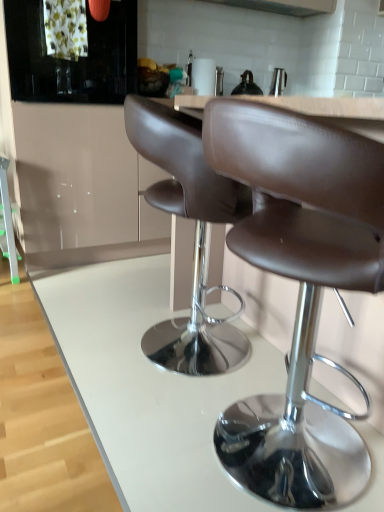
Question: Is satin silver exhaust hood at upper center located within brown leather stool at center?

Choices:
 (A) yes
 (B) no

Answer: (B)

Question: Is brown leather stool at center not near satin silver exhaust hood at upper center?

Choices:
 (A) no
 (B) yes

Answer: (B)

Question: Is brown leather stool at center wider than satin silver exhaust hood at upper center?

Choices:
 (A) yes
 (B) no

Answer: (A)

Question: Is brown leather stool at center at the right side of satin silver exhaust hood at upper center?

Choices:
 (A) no
 (B) yes

Answer: (A)

Question: Can you confirm if brown leather stool at center is bigger than satin silver exhaust hood at upper center?

Choices:
 (A) yes
 (B) no

Answer: (A)

Question: From the image's perspective, is black glass cabinet at upper left, marked as the second cabinetry in a bottom-to-top arrangement, located above or below brown leather stool at center?

Choices:
 (A) above
 (B) below

Answer: (A)

Question: In terms of size, does black glass cabinet at upper left, marked as the second cabinetry in a bottom-to-top arrangement, appear bigger or smaller than brown leather stool at center?

Choices:
 (A) big
 (B) small

Answer: (B)

Question: Is black glass cabinet at upper left, the 1th cabinetry from the top, in front of or behind brown leather stool at center in the image?

Choices:
 (A) behind
 (B) front

Answer: (A)

Question: In terms of height, does black glass cabinet at upper left, marked as the second cabinetry in a bottom-to-top arrangement, look taller or shorter compared to brown leather stool at center?

Choices:
 (A) tall
 (B) short

Answer: (B)

Question: In terms of height, does glossy white cabinet at upper left, the first cabinetry in the bottom-to-top sequence, look taller or shorter compared to white glossy counter at center?

Choices:
 (A) tall
 (B) short

Answer: (A)

Question: Is glossy white cabinet at upper left, the 2th cabinetry in the top-to-bottom sequence, to the left or to the right of white glossy counter at center in the image?

Choices:
 (A) left
 (B) right

Answer: (A)

Question: Is glossy white cabinet at upper left, the 2th cabinetry in the top-to-bottom sequence, wider or thinner than white glossy counter at center?

Choices:
 (A) thin
 (B) wide

Answer: (A)

Question: Is glossy white cabinet at upper left, the first cabinetry in the bottom-to-top sequence, spatially inside white glossy counter at center, or outside of it?

Choices:
 (A) inside
 (B) outside

Answer: (B)

Question: In terms of height, does white glossy counter at center look taller or shorter compared to brown leather stool at center?

Choices:
 (A) tall
 (B) short

Answer: (B)

Question: Does point (198, 489) appear closer or farther from the camera than point (263, 419)?

Choices:
 (A) farther
 (B) closer

Answer: (B)